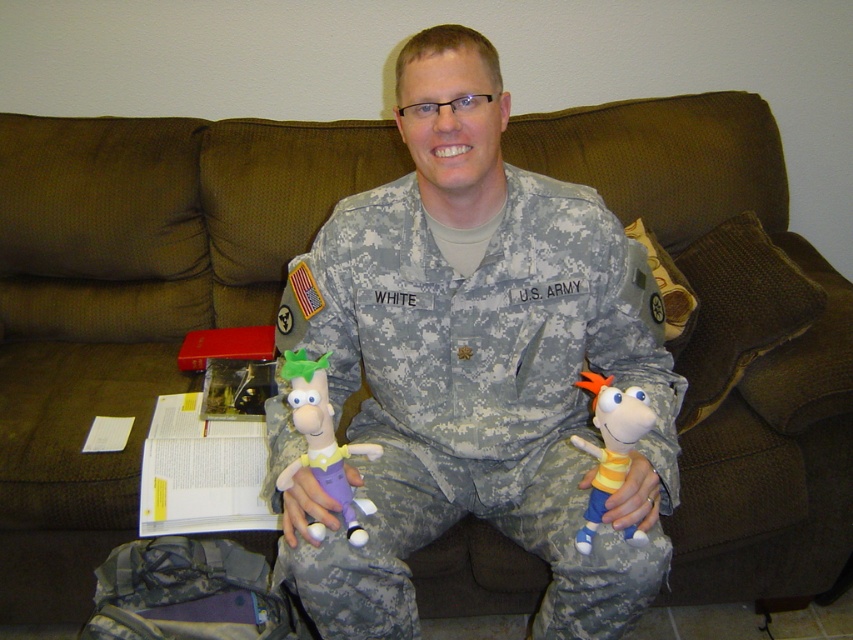
In the scene shown: Between camouflage fabric us army uniform at center and yellow striped fabric doll at lower right, which one is positioned lower?

yellow striped fabric doll at lower right

Does camouflage fabric us army uniform at center have a lesser height compared to yellow striped fabric doll at lower right?

Incorrect, camouflage fabric us army uniform at center's height does not fall short of yellow striped fabric doll at lower right's.

Where is `camouflage fabric us army uniform at center`? This screenshot has height=640, width=853. camouflage fabric us army uniform at center is located at coordinates (480, 397).

Locate an element on the screen. The width and height of the screenshot is (853, 640). camouflage fabric us army uniform at center is located at coordinates (480, 397).

Does camouflage fabric us army uniform at center appear on the left side of plush green hat at center?

No, camouflage fabric us army uniform at center is not to the left of plush green hat at center.

Does point (350, 285) come farther from viewer compared to point (323, 528)?

Yes, point (350, 285) is behind point (323, 528).

What do you see at coordinates (480, 397) in the screenshot?
I see `camouflage fabric us army uniform at center` at bounding box center [480, 397].

Locate an element on the screen. camouflage fabric us army uniform at center is located at coordinates (480, 397).

Image resolution: width=853 pixels, height=640 pixels. I want to click on plush green hat at center, so click(322, 440).

What do you see at coordinates (322, 440) in the screenshot? This screenshot has height=640, width=853. I see `plush green hat at center` at bounding box center [322, 440].

Does point (351, 516) come behind point (628, 444)?

Yes, point (351, 516) is behind point (628, 444).

In order to click on plush green hat at center in this screenshot , I will do `click(322, 440)`.